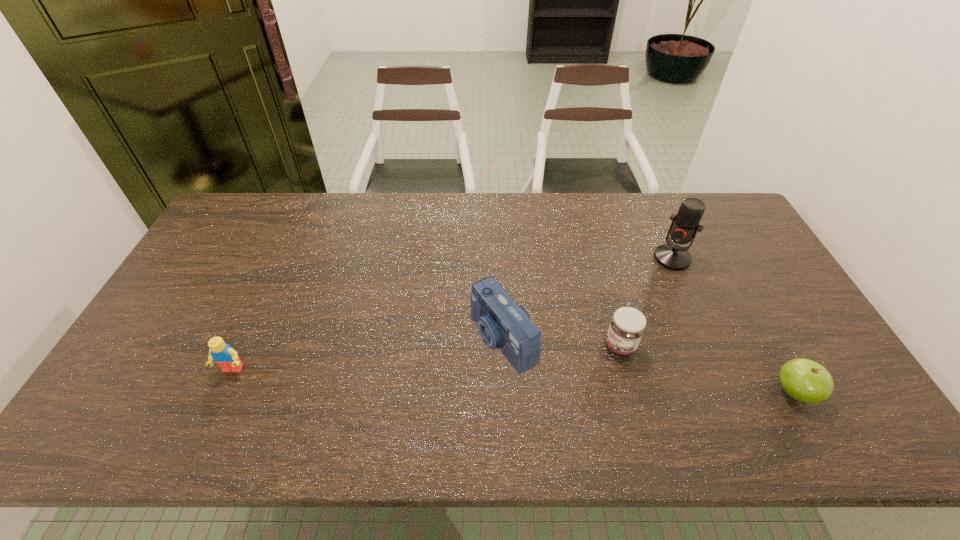
I want to click on the leftmost object, so (224, 355).

Image resolution: width=960 pixels, height=540 pixels. Identify the location of apple. (805, 380).

This screenshot has width=960, height=540. In order to click on the fourth object from left to right in this screenshot , I will do `click(684, 227)`.

This screenshot has width=960, height=540. I want to click on the tallest object, so click(x=684, y=227).

This screenshot has width=960, height=540. In order to click on jam in this screenshot , I will do `click(627, 326)`.

The height and width of the screenshot is (540, 960). I want to click on the second object from left to right, so click(501, 323).

Find the location of `vacant space located on the front-facing side of the Lego`. vacant space located on the front-facing side of the Lego is located at coordinates (218, 403).

Locate an element on the screen. The image size is (960, 540). blank space located 0.120m on the left of the apple is located at coordinates (723, 392).

Find the location of a particular element. Image resolution: width=960 pixels, height=540 pixels. vacant region located 0.310m on the side of the microphone with the red ring is located at coordinates (616, 327).

Locate an element on the screen. vacant space positioned 0.110m on the side of the microphone with the red ring is located at coordinates (649, 287).